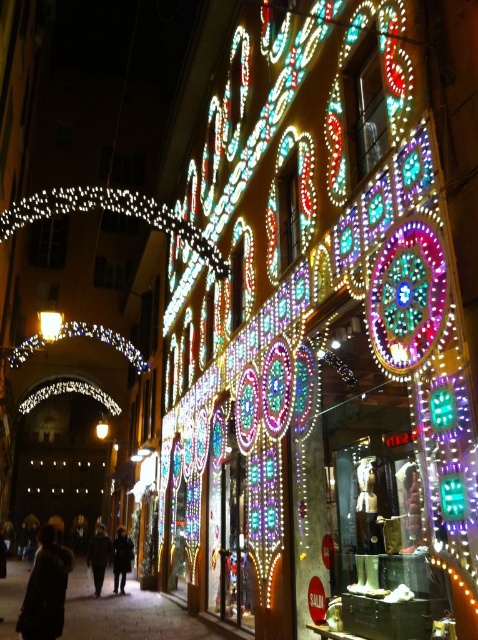
You are standing in the festive street scene and want to pick up the closest coat to you. Which coat should you choose between the dark wool coat at lower left and the dark gray coat at lower left?

The dark wool coat at lower left is closer to the viewer than the dark gray coat at lower left, so you should choose the dark wool coat at lower left.

You are at the festive street scene and need to decide which coat to take. The dark wool coat at lower left and the dark brown coat at center are both available. Based on their widths, which one might you choose if you want a wider coat?

The dark wool coat at lower left might be wider than the dark brown coat at center, so you should choose the dark wool coat at lower left if you want a wider coat.